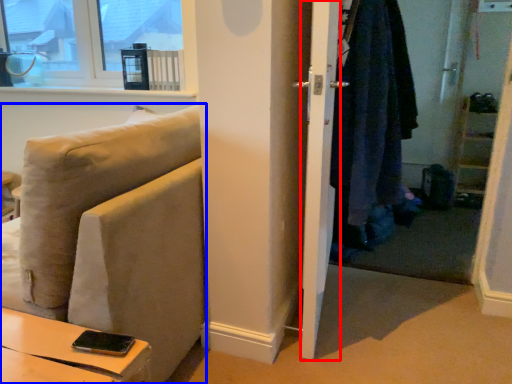
Question: Which point is closer to the camera, screen door (highlighted by a red box) or studio couch (highlighted by a blue box)?

Choices:
 (A) screen door
 (B) studio couch

Answer: (B)